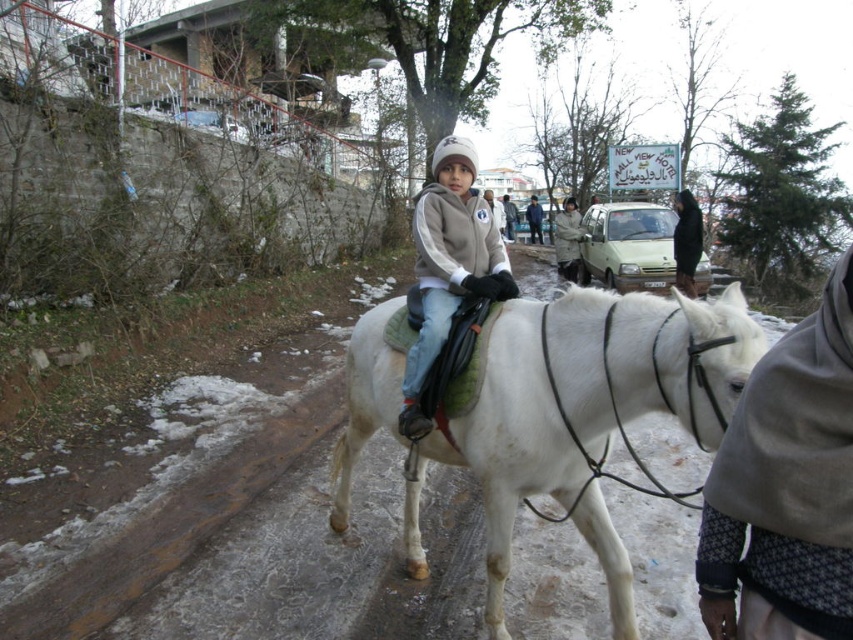
Question: Does matte gray hoodie at center appear on the left side of blue denim jacket at center?

Choices:
 (A) no
 (B) yes

Answer: (B)

Question: Estimate the real-world distances between objects in this image. Which object is closer to the light gray woolen sweater at center?

Choices:
 (A) light gray fleece jacket at center
 (B) matte gray hoodie at center

Answer: (A)

Question: Which object is the farthest from the light gray woolen sweater at center?

Choices:
 (A) light gray fleece jacket at center
 (B) blue denim jacket at center

Answer: (B)

Question: Does matte gray hoodie at center appear over black fabric bag at center?

Choices:
 (A) yes
 (B) no

Answer: (B)

Question: Observing the image, what is the correct spatial positioning of black fabric bag at center in reference to light gray fleece jacket at center?

Choices:
 (A) above
 (B) below

Answer: (B)

Question: Which of the following is the farthest from the observer?

Choices:
 (A) (538, 205)
 (B) (502, 221)
 (C) (505, 211)

Answer: (A)